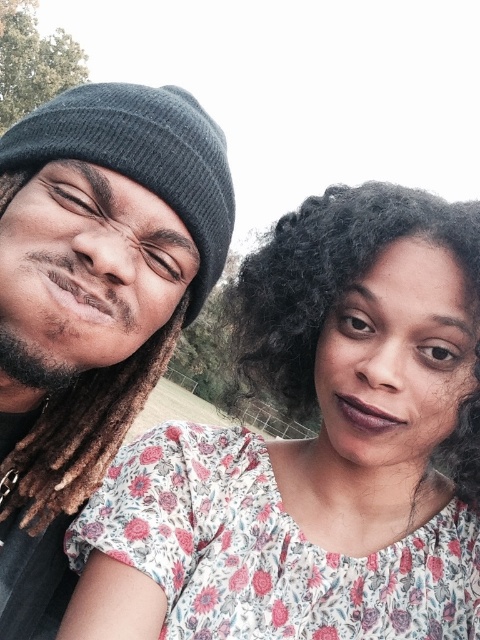
Between curly dark brown hair at upper right and brown dreadlocks at left, which one appears on the left side from the viewer's perspective?

Positioned to the left is brown dreadlocks at left.

Between point (428, 198) and point (81, 486), which one is positioned behind?

Point (81, 486)

Image resolution: width=480 pixels, height=640 pixels. Identify the location of curly dark brown hair at upper right. (331, 276).

Locate an element on the screen. Image resolution: width=480 pixels, height=640 pixels. dark gray knit beanie at left is located at coordinates (93, 301).

Is dark gray knit beanie at left above curly dark brown hair at upper right?

Correct, dark gray knit beanie at left is located above curly dark brown hair at upper right.

At what (x,y) coordinates should I click in order to perform the action: click on dark gray knit beanie at left. Please return your answer as a coordinate pair (x, y). The width and height of the screenshot is (480, 640). Looking at the image, I should click on (93, 301).

Is point (63, 113) closer to camera compared to point (111, 419)?

Yes, it is in front of point (111, 419).

Is dark gray knit beanie at left positioned at the back of brown dreadlocks at left?

No, it is not.

Does point (223, 161) come behind point (67, 451)?

No, (223, 161) is in front of (67, 451).

Locate an element on the screen. The height and width of the screenshot is (640, 480). dark gray knit beanie at left is located at coordinates (93, 301).